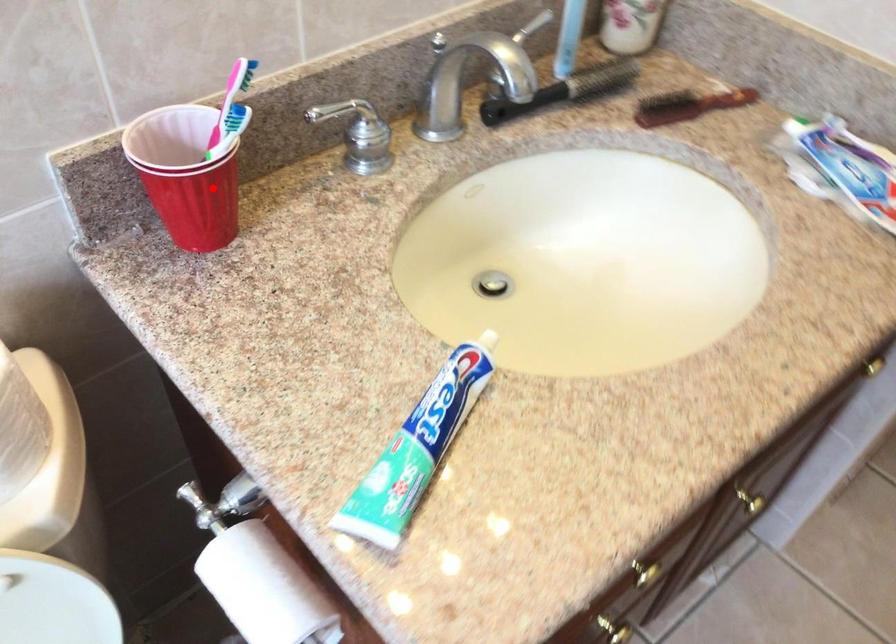
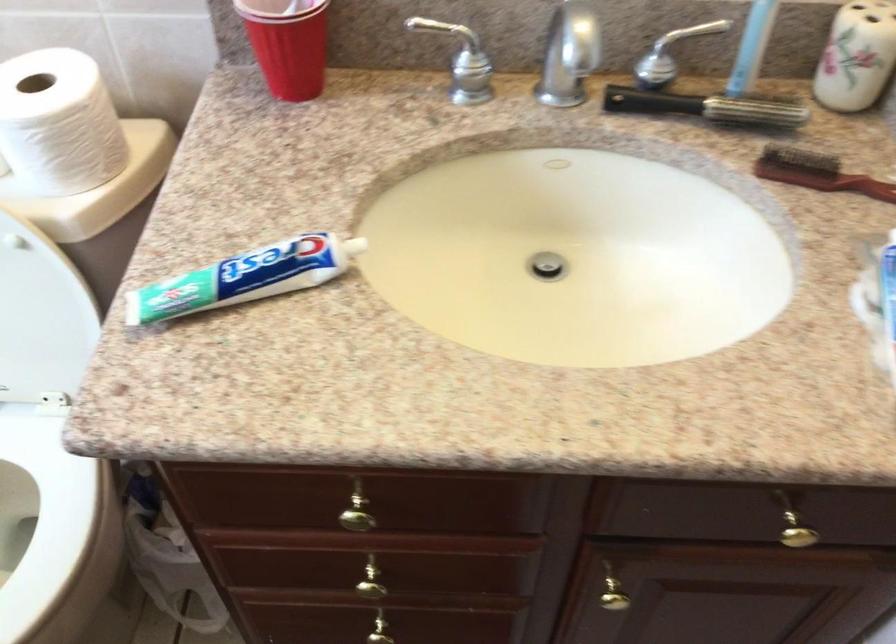
Question: I am providing you with two images of the same scene from different viewpoints. A red point is shown in image1. For the corresponding object point in image2, is it positioned nearer or farther from the camera?

Choices:
 (A) Nearer
 (B) Farther

Answer: (B)